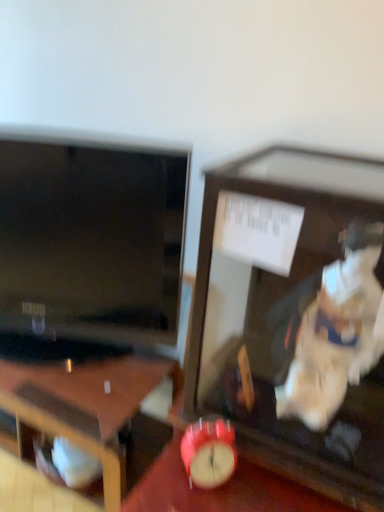
Question: Is matte red alarm clock at lower right positioned in front of matte black tv at left?

Choices:
 (A) no
 (B) yes

Answer: (B)

Question: Does matte red alarm clock at lower right contain matte black tv at left?

Choices:
 (A) no
 (B) yes

Answer: (A)

Question: From a real-world perspective, does matte red alarm clock at lower right sit lower than matte black tv at left?

Choices:
 (A) no
 (B) yes

Answer: (B)

Question: From the image's perspective, is matte red alarm clock at lower right under matte black tv at left?

Choices:
 (A) yes
 (B) no

Answer: (A)

Question: Considering the relative sizes of matte red alarm clock at lower right and matte black tv at left in the image provided, is matte red alarm clock at lower right shorter than matte black tv at left?

Choices:
 (A) yes
 (B) no

Answer: (A)

Question: In terms of height, does matte black tv at left look taller or shorter compared to wooden desk at lower left?

Choices:
 (A) tall
 (B) short

Answer: (A)

Question: Relative to wooden desk at lower left, is matte black tv at left in front or behind?

Choices:
 (A) front
 (B) behind

Answer: (A)

Question: Is point (144, 177) positioned closer to the camera than point (117, 499)?

Choices:
 (A) farther
 (B) closer

Answer: (A)

Question: Is matte black tv at left inside or outside of wooden desk at lower left?

Choices:
 (A) outside
 (B) inside

Answer: (A)

Question: In the image, is matte black tv at left positioned in front of or behind matte red alarm clock at center?

Choices:
 (A) behind
 (B) front

Answer: (A)

Question: Considering the positions of matte black tv at left and matte red alarm clock at center in the image, is matte black tv at left bigger or smaller than matte red alarm clock at center?

Choices:
 (A) small
 (B) big

Answer: (B)

Question: From the image's perspective, is matte black tv at left above or below matte red alarm clock at center?

Choices:
 (A) below
 (B) above

Answer: (B)

Question: In terms of width, does matte black tv at left look wider or thinner when compared to matte red alarm clock at center?

Choices:
 (A) thin
 (B) wide

Answer: (A)

Question: Considering their positions, is wooden desk at lower left located in front of or behind matte red alarm clock at center?

Choices:
 (A) behind
 (B) front

Answer: (A)

Question: Looking at the image, does wooden desk at lower left seem bigger or smaller compared to matte red alarm clock at center?

Choices:
 (A) small
 (B) big

Answer: (B)